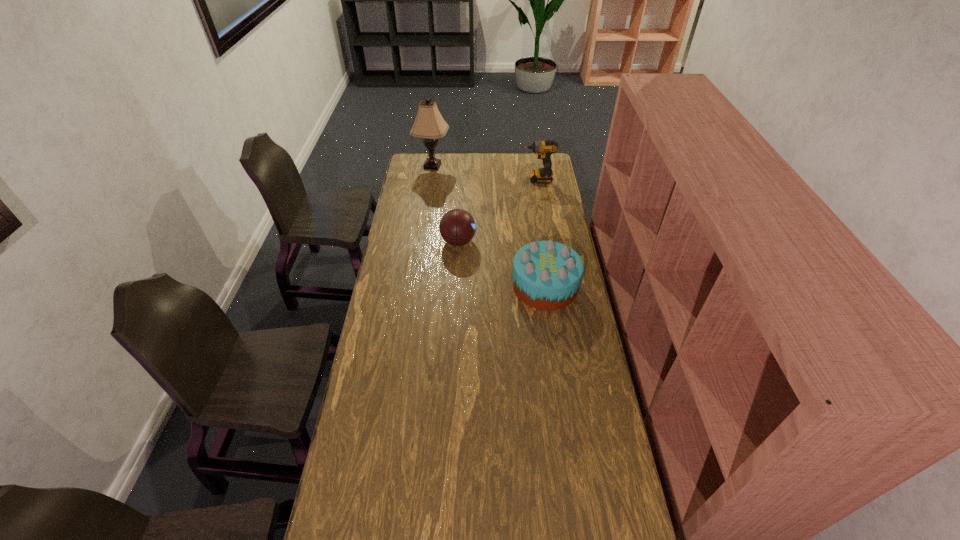
I want to click on free space at the far left corner, so click(422, 167).

Locate an element on the screen. The image size is (960, 540). free space between the farthest object and the basketball is located at coordinates (445, 204).

Identify the location of free space between the tallest object and the basketball. (445, 204).

Identify the location of empty space that is in between the cake and the basketball. (502, 264).

Where is `vacant point located between the drill and the second nearest object`? This screenshot has width=960, height=540. vacant point located between the drill and the second nearest object is located at coordinates (497, 211).

This screenshot has width=960, height=540. Find the location of `free spot between the tallest object and the nearest object`. free spot between the tallest object and the nearest object is located at coordinates (489, 226).

Locate an element on the screen. vacant region between the drill and the lamp is located at coordinates click(x=485, y=173).

Identify the location of free space that is in between the cake and the second nearest object. The image size is (960, 540). (502, 264).

Locate an element on the screen. Image resolution: width=960 pixels, height=540 pixels. blank region between the third shortest object and the lamp is located at coordinates (485, 173).

Image resolution: width=960 pixels, height=540 pixels. I want to click on vacant area that lies between the basketball and the nearest object, so click(502, 264).